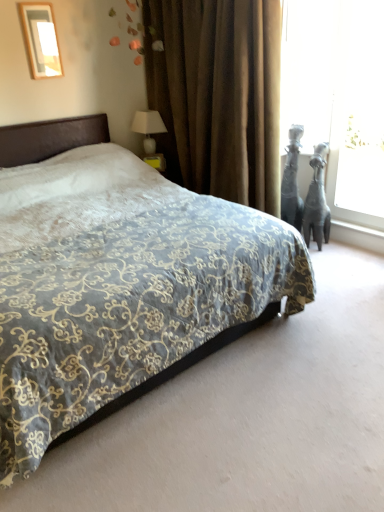
The image size is (384, 512). I want to click on vacant region above white glossy wood at right (from a real-world perspective), so click(x=354, y=226).